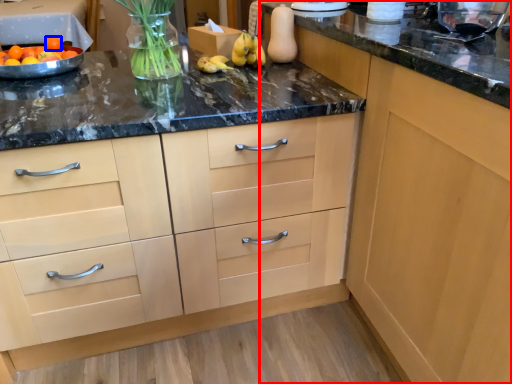
Question: Among these objects, which one is nearest to the camera, cabinetry (highlighted by a red box) or tangerine (highlighted by a blue box)?

Choices:
 (A) cabinetry
 (B) tangerine

Answer: (A)